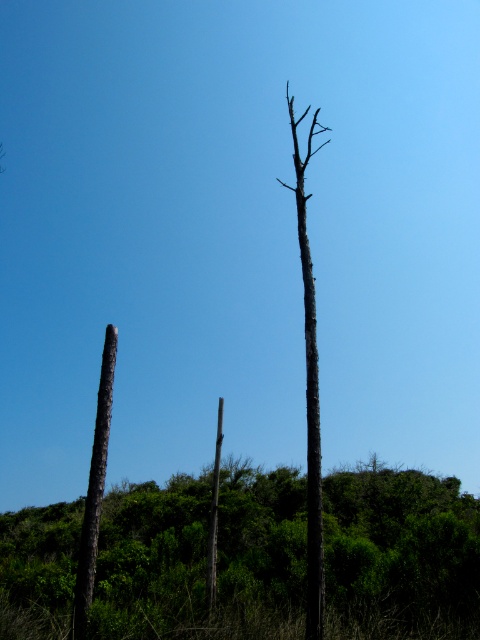
Question: Does smooth gray tree trunk at center have a lesser width compared to charcoal rough log at left?

Choices:
 (A) no
 (B) yes

Answer: (A)

Question: Among these objects, which one is nearest to the camera?

Choices:
 (A) brown rough tree trunk at left
 (B) smooth gray pole at center

Answer: (A)

Question: Among these objects, which one is farthest from the camera?

Choices:
 (A) charcoal rough log at left
 (B) smooth gray pole at center

Answer: (B)

Question: Can you confirm if smooth gray tree trunk at center is positioned to the left of smooth gray pole at center?

Choices:
 (A) no
 (B) yes

Answer: (A)

Question: Which point is farther to the camera?

Choices:
 (A) (322, 541)
 (B) (222, 422)
 (C) (100, 435)
 (D) (163, 625)

Answer: (B)

Question: Can you confirm if smooth gray tree trunk at center is smaller than smooth gray pole at center?

Choices:
 (A) no
 (B) yes

Answer: (A)